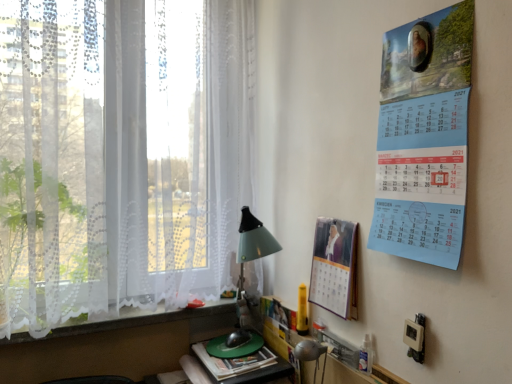
Question: Is the position of green plastic computer mouse at lower center less distant than that of white lace curtain at left?

Choices:
 (A) yes
 (B) no

Answer: (B)

Question: Is green plastic computer mouse at lower center located outside white lace curtain at left?

Choices:
 (A) no
 (B) yes

Answer: (B)

Question: Is green plastic computer mouse at lower center at the left side of white lace curtain at left?

Choices:
 (A) yes
 (B) no

Answer: (B)

Question: Would you say green plastic computer mouse at lower center is a long distance from white lace curtain at left?

Choices:
 (A) no
 (B) yes

Answer: (A)

Question: Considering the relative sizes of green plastic computer mouse at lower center and white lace curtain at left in the image provided, is green plastic computer mouse at lower center taller than white lace curtain at left?

Choices:
 (A) no
 (B) yes

Answer: (A)

Question: Is white lace curtain at left at the back of green plastic computer mouse at lower center?

Choices:
 (A) yes
 (B) no

Answer: (B)

Question: From the image's perspective, does blue paper calendar at upper right, the second poster page from the back, appear higher than matte paper calendar at right, which is the first poster page from back to front?

Choices:
 (A) yes
 (B) no

Answer: (A)

Question: Considering the relative sizes of blue paper calendar at upper right, which is counted as the second poster page, starting from the bottom, and matte paper calendar at right, which is counted as the second poster page, starting from the front, in the image provided, is blue paper calendar at upper right, which is counted as the second poster page, starting from the bottom, shorter than matte paper calendar at right, which is counted as the second poster page, starting from the front,?

Choices:
 (A) no
 (B) yes

Answer: (A)

Question: Is matte paper calendar at right, which is counted as the second poster page, starting from the front, at the back of blue paper calendar at upper right, which is the 1th poster page in front-to-back order?

Choices:
 (A) yes
 (B) no

Answer: (B)

Question: Considering the relative positions of blue paper calendar at upper right, positioned as the 2th poster page in left-to-right order, and matte paper calendar at right, which is counted as the second poster page, starting from the front, in the image provided, is blue paper calendar at upper right, positioned as the 2th poster page in left-to-right order, behind matte paper calendar at right, which is counted as the second poster page, starting from the front,?

Choices:
 (A) no
 (B) yes

Answer: (A)

Question: Does blue paper calendar at upper right, which is the 1th poster page in right-to-left order, have a larger size compared to matte paper calendar at right, which is the first poster page from back to front?

Choices:
 (A) yes
 (B) no

Answer: (A)

Question: Does blue paper calendar at upper right, which is the 1th poster page in right-to-left order, appear on the left side of matte paper calendar at right, which is the first poster page from back to front?

Choices:
 (A) yes
 (B) no

Answer: (B)

Question: From the image's perspective, is matte paper calendar at right, marked as the 2th poster page in a top-to-bottom arrangement, under white lace at lower left?

Choices:
 (A) no
 (B) yes

Answer: (A)